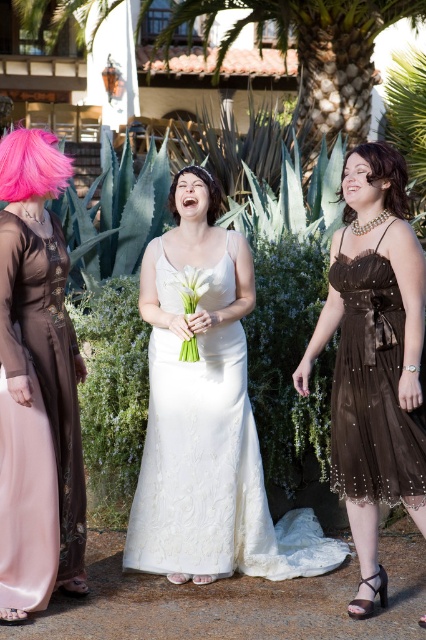
Question: Can you confirm if brown shiny hair at upper right is smaller than dark brown curly hair at center?

Choices:
 (A) no
 (B) yes

Answer: (A)

Question: Which object appears closest to the camera in this image?

Choices:
 (A) white silk bouquet at center
 (B) pink satin dress at left
 (C) brown sheer dress at right

Answer: (B)

Question: Which object appears farthest from the camera in this image?

Choices:
 (A) pink satin dress at left
 (B) dark brown curly hair at center
 (C) brown shiny hair at upper right
 (D) white silk bouquet at center

Answer: (B)

Question: Is ivory satin dress at center below white silk bouquet at center?

Choices:
 (A) yes
 (B) no

Answer: (A)

Question: Which object is farther from the camera taking this photo?

Choices:
 (A) ivory satin dress at center
 (B) brown shiny hair at upper right
 (C) pink satin dress at left

Answer: (A)

Question: Can you confirm if brown sheer dress at right is positioned below white silk bouquet at center?

Choices:
 (A) yes
 (B) no

Answer: (A)